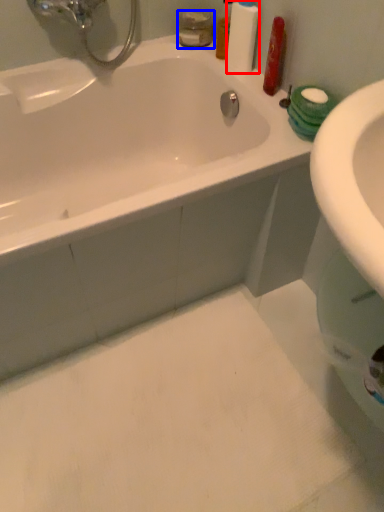
Question: Among these objects, which one is nearest to the camera, cleaning product (highlighted by a red box) or mouthwash (highlighted by a blue box)?

Choices:
 (A) cleaning product
 (B) mouthwash

Answer: (A)